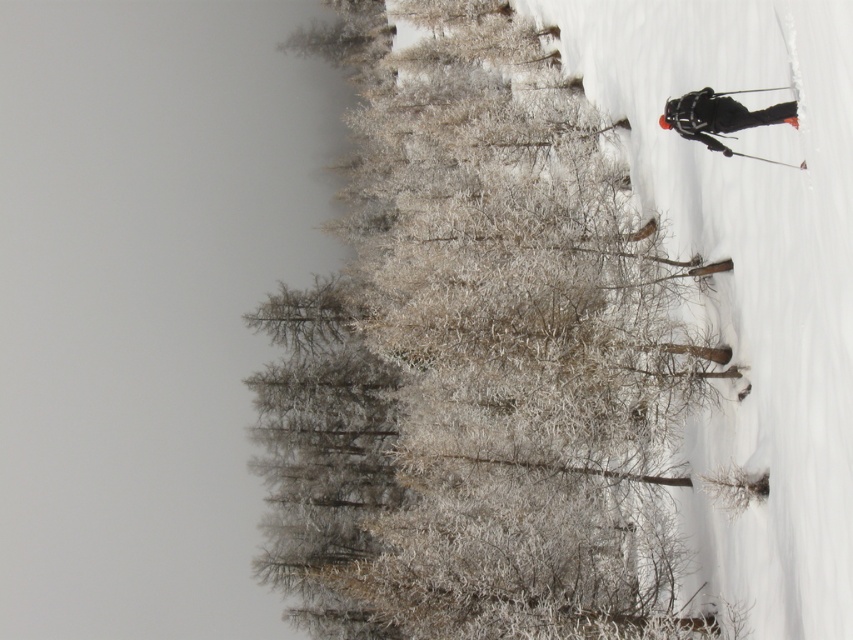
You are a photographer capturing this winter scene. You want to ensure that both the white snow at right and the black matte ski suit at right are visible in your photo. Given that the snow is above the ski suit, which object should you adjust your exposure settings to prioritize for proper lighting?

Since the white snow at right is located above the black matte ski suit at right, you should prioritize adjusting exposure settings for the black matte ski suit at right to ensure it isn not underexposed while the snow remains properly lit.